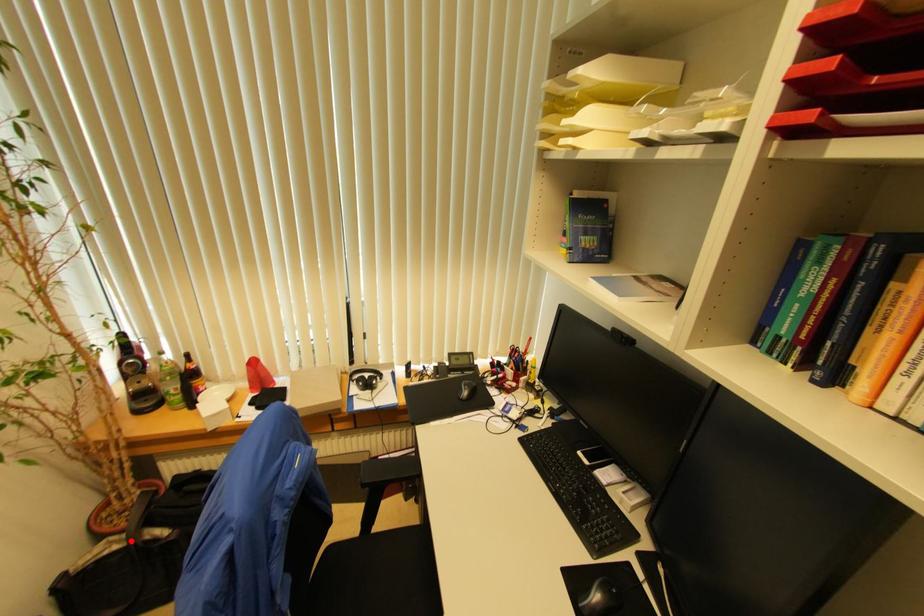
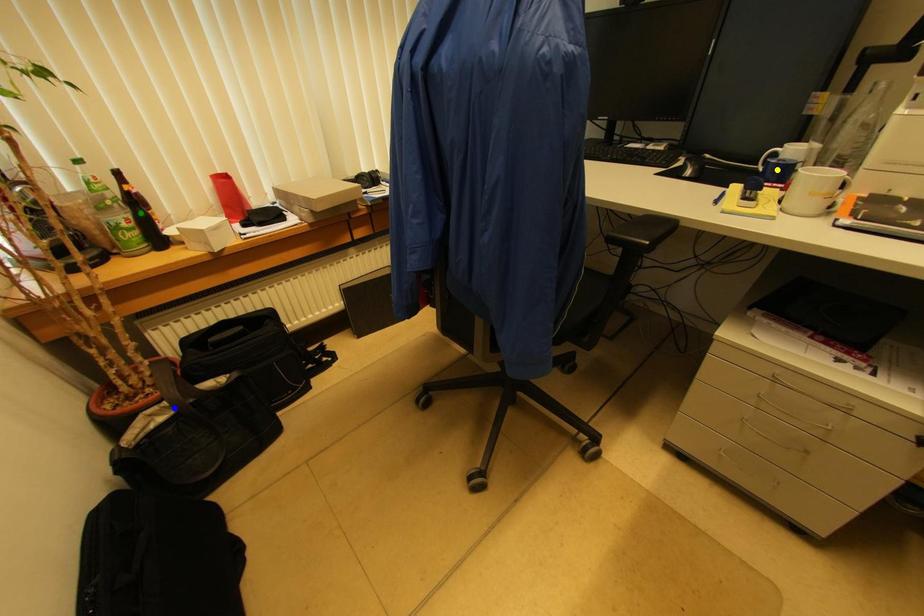
Question: I am providing you with two images of the same scene from different viewpoints. A red point is marked on the first image. You are given multiple points on the second image. In image 2, which mark is for the same physical point as the one in image 1?

Choices:
 (A) yellow point
 (B) green point
 (C) blue point

Answer: (C)